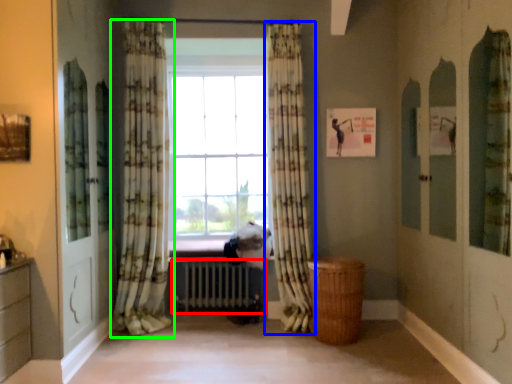
Question: Which is farther away from radiator (highlighted by a red box)? curtain (highlighted by a blue box) or curtain (highlighted by a green box)?

Choices:
 (A) curtain
 (B) curtain

Answer: (A)